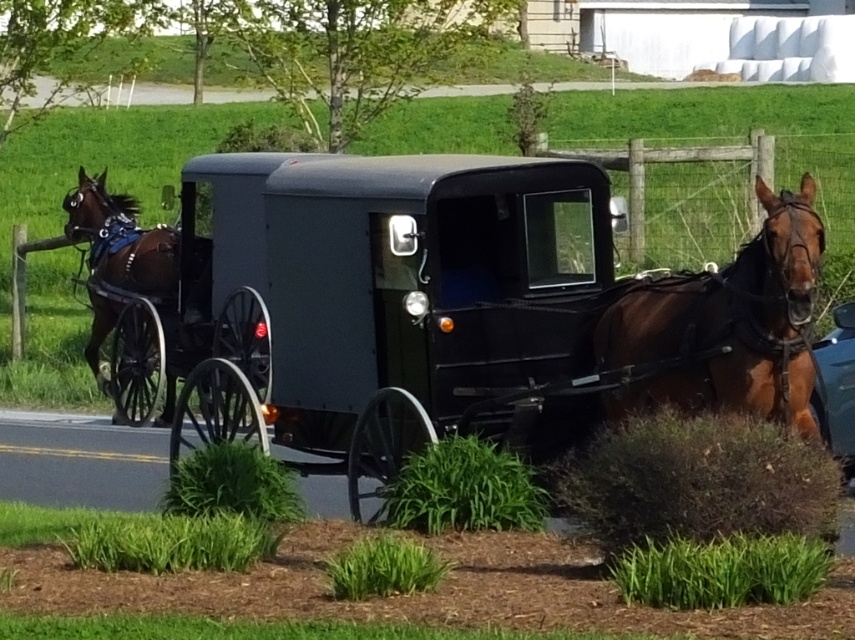
Find the location of a particular element. The width and height of the screenshot is (855, 640). matte black horse cart at center is located at coordinates (449, 312).

Who is lower down, matte black horse cart at center or brown glossy horse at left?

matte black horse cart at center is lower down.

You are a GUI agent. You are given a task and a screenshot of the screen. Output one action in this format:
    pyautogui.click(x=<x>, y=<y>)
    Task: Click on the matte black horse cart at center
    The image size is (855, 640).
    Given the screenshot: What is the action you would take?
    tap(449, 312)

How much distance is there between matte black horse cart at center and brown glossy horse at right?

matte black horse cart at center and brown glossy horse at right are 7.97 meters apart from each other.

Is point (148, 353) closer to viewer compared to point (762, 388)?

No, (148, 353) is behind (762, 388).

The height and width of the screenshot is (640, 855). Find the location of `matte black horse cart at center`. matte black horse cart at center is located at coordinates (449, 312).

Is point (168, 266) positioned before point (836, 440)?

No, (168, 266) is further to viewer.

Does brown glossy horse at left come in front of blue glossy car at right?

No, it is behind blue glossy car at right.

You are a GUI agent. You are given a task and a screenshot of the screen. Output one action in this format:
    pyautogui.click(x=<x>, y=<y>)
    Task: Click on the brown glossy horse at left
    The height and width of the screenshot is (640, 855).
    Given the screenshot: What is the action you would take?
    pyautogui.click(x=121, y=241)